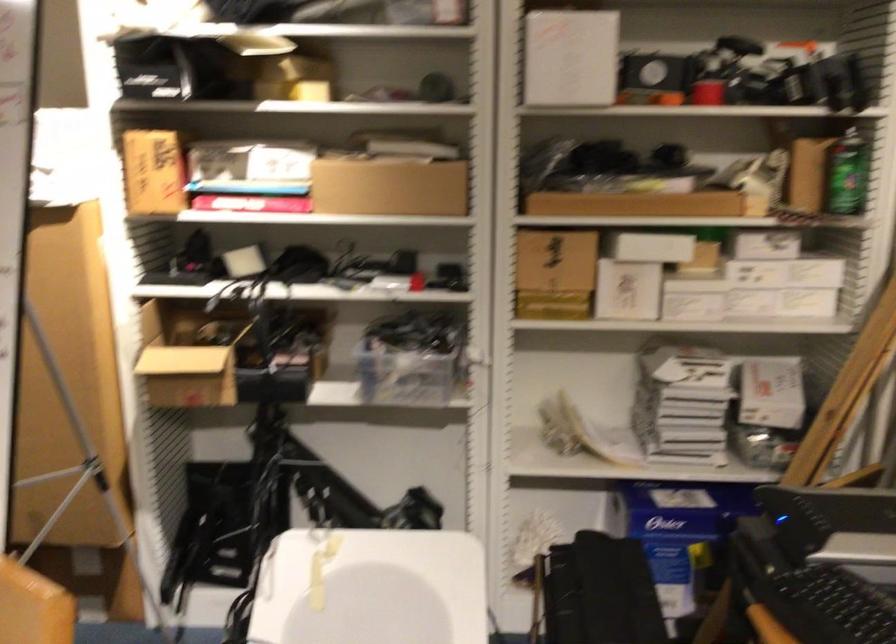
Where would you lift the green spray can? Please return your answer as a coordinate pair (x, y).

(848, 174)